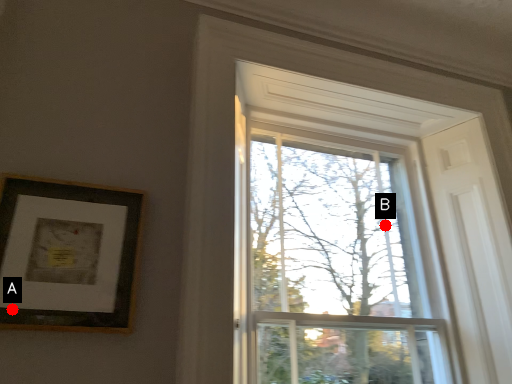
Question: Two points are circled on the image, labeled by A and B beside each circle. Among these points, which one is farthest from the camera?

Choices:
 (A) A is further
 (B) B is further

Answer: (B)